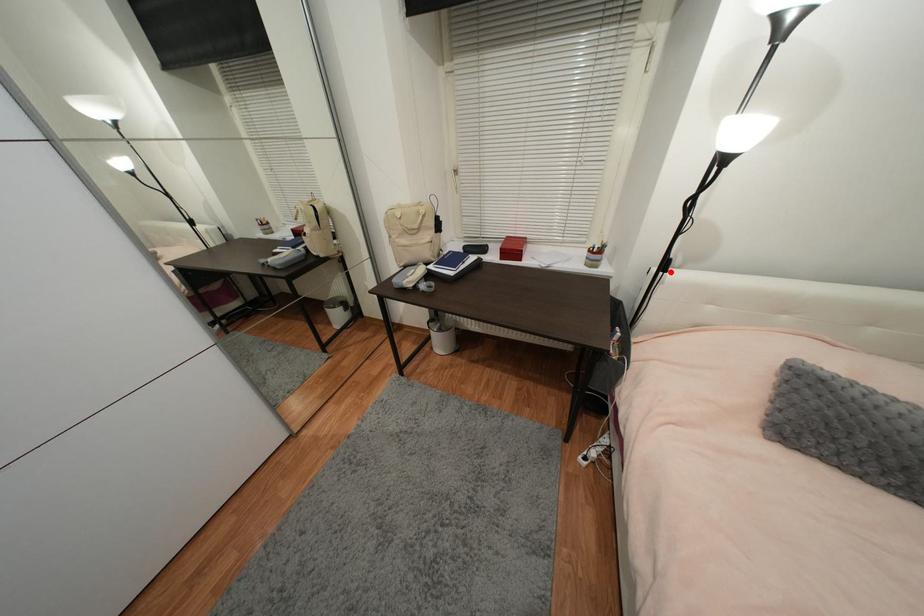
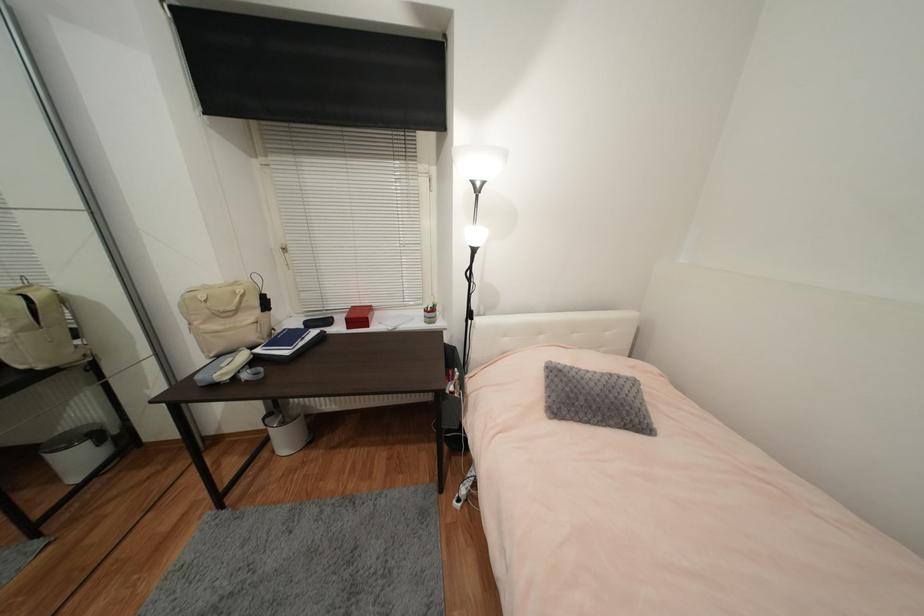
Question: I am providing you with two images of the same scene from different viewpoints. A red point is shown in image1. For the corresponding object point in image2, is it positioned nearer or farther from the camera?

Choices:
 (A) Nearer
 (B) Farther

Answer: (B)